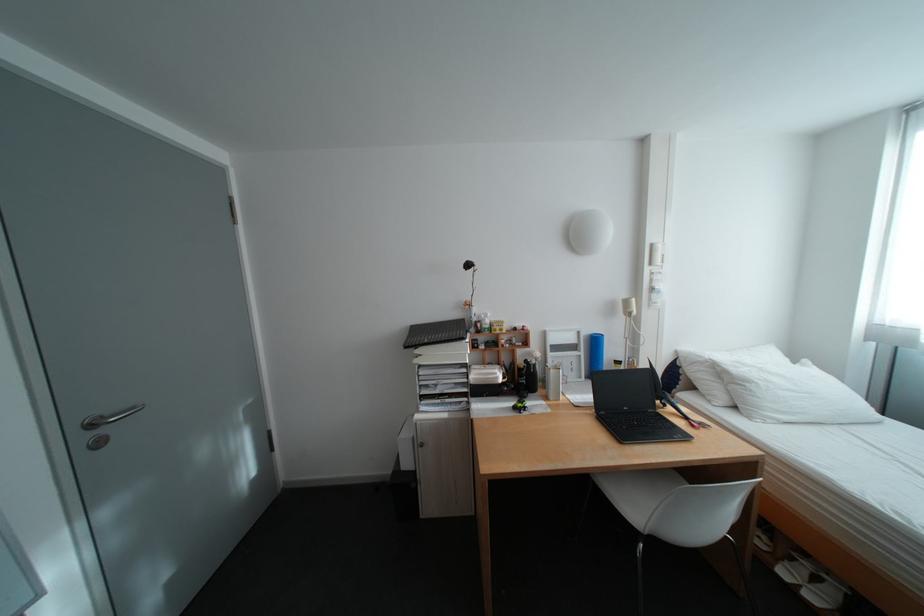
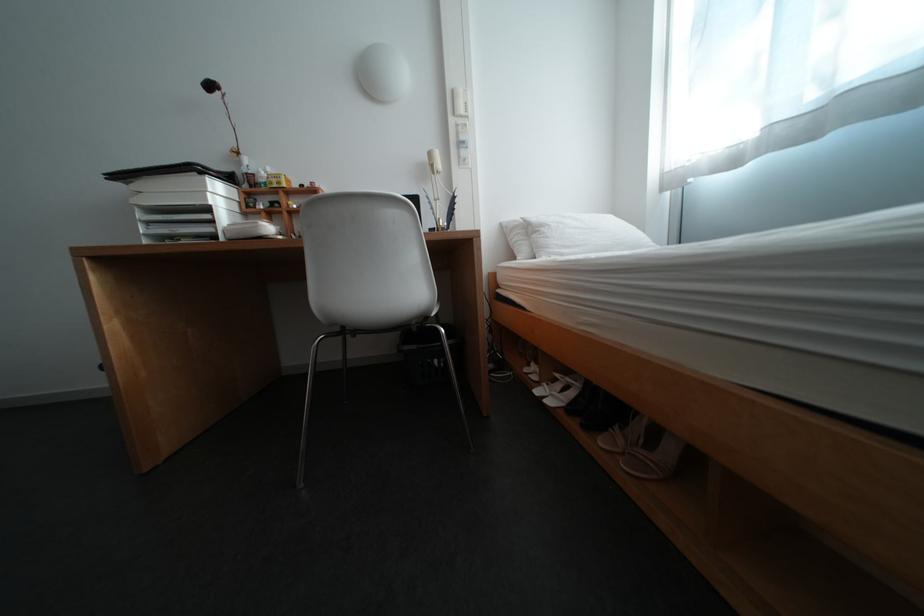
Find the pixel in the second image that matches point 664,246 in the first image.

(466, 92)